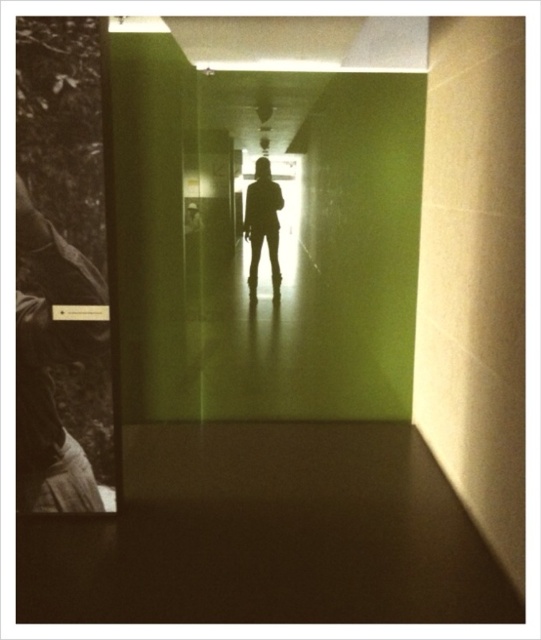
You are standing in the corridor and notice a point marked at coordinates (50,364). What object is located at that point?

The point at (50,364) corresponds to the sepia toned photograph of man at left.